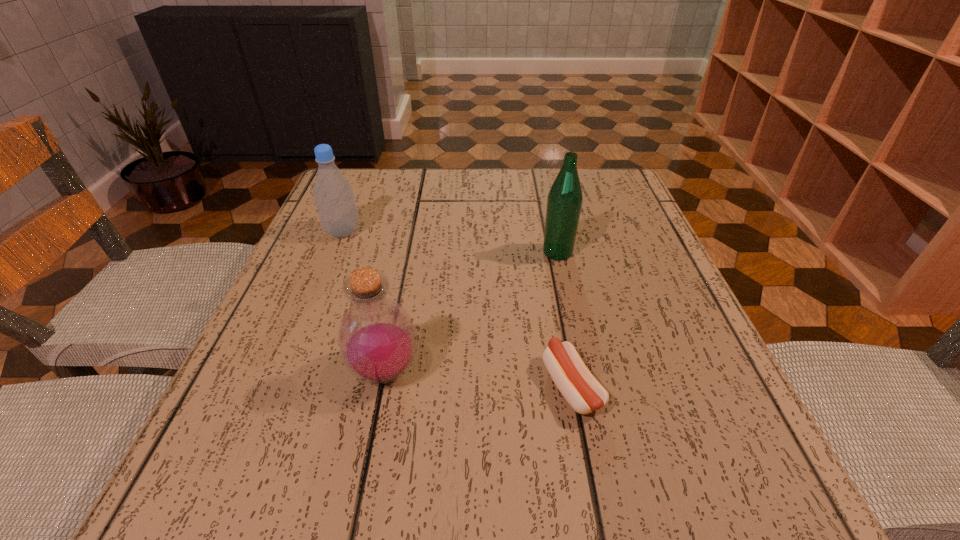
Identify the location of the rightmost bottle. This screenshot has width=960, height=540. (564, 202).

Where is `the second nearest bottle`? This screenshot has height=540, width=960. the second nearest bottle is located at coordinates (564, 202).

Where is `the farthest bottle`? The height and width of the screenshot is (540, 960). the farthest bottle is located at coordinates (333, 194).

Find the location of a particular element. This screenshot has height=540, width=960. the farthest object is located at coordinates 333,194.

Locate an element on the screen. Image resolution: width=960 pixels, height=540 pixels. the nearest bottle is located at coordinates (377, 341).

At what (x,y) coordinates should I click in order to perform the action: click on the second bottle from right to left. Please return your answer as a coordinate pair (x, y). The width and height of the screenshot is (960, 540). Looking at the image, I should click on coord(377,341).

Where is `the shortest object`? the shortest object is located at coordinates (576, 383).

You are a GUI agent. You are given a task and a screenshot of the screen. Output one action in this format:
    pyautogui.click(x=<x>, y=<y>)
    Task: Click on the vacant space situated on the back of the third nearest object
    This screenshot has height=540, width=960.
    Given the screenshot: What is the action you would take?
    pyautogui.click(x=547, y=205)

Where is `vacant area situated on the back of the farthest bottle`? vacant area situated on the back of the farthest bottle is located at coordinates (366, 175).

I want to click on free space located 0.130m on the right of the second object from left to right, so click(x=504, y=371).